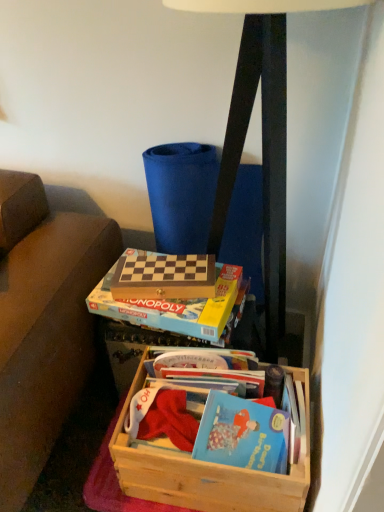
Where is `empty space that is ontop of wooden crate at lower center (from a real-world perspective)`? empty space that is ontop of wooden crate at lower center (from a real-world perspective) is located at coordinates (216, 388).